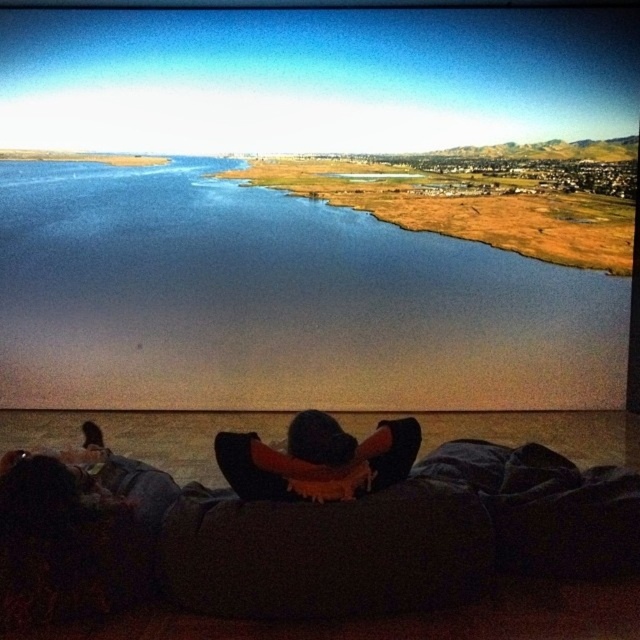
Question: Which object is farther from the camera taking this photo?

Choices:
 (A) black fuzzy hat at center
 (B) blue water at center

Answer: (B)

Question: Can you confirm if blue water at center is positioned below black fuzzy hat at center?

Choices:
 (A) yes
 (B) no

Answer: (B)

Question: Is the position of blue water at center more distant than that of black fuzzy hat at center?

Choices:
 (A) yes
 (B) no

Answer: (A)

Question: Can you confirm if blue water at center is positioned above black fuzzy hat at center?

Choices:
 (A) yes
 (B) no

Answer: (A)

Question: Which point is farther to the camera?

Choices:
 (A) (406, 422)
 (B) (317, 316)

Answer: (B)